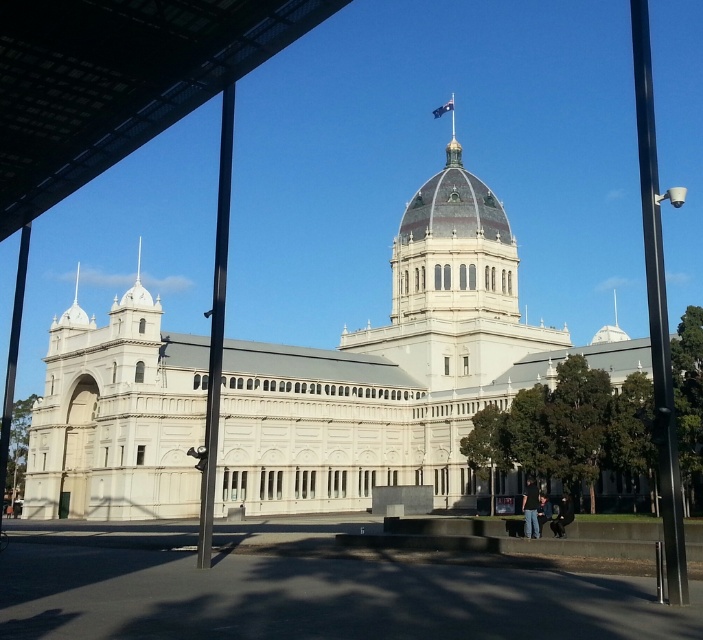
Is dark gray metal canopy at upper center in front of black metal pole at center?

Yes, it is.

Who is lower down, dark gray metal canopy at upper center or black metal pole at center?

black metal pole at center is lower down.

Who is more forward, (15,156) or (224,141)?

Point (15,156) is more forward.

Locate an element on the screen. The width and height of the screenshot is (703, 640). dark gray metal canopy at upper center is located at coordinates (117, 80).

Who is positioned more to the left, black metal pole at center or black metal pole at left?

Positioned to the left is black metal pole at left.

Is black metal pole at center bigger than black metal pole at left?

Actually, black metal pole at center might be smaller than black metal pole at left.

Does point (225, 145) come in front of point (0, 468)?

No, (225, 145) is behind (0, 468).

The height and width of the screenshot is (640, 703). Find the location of `black metal pole at center`. black metal pole at center is located at coordinates (214, 332).

From the picture: Between white stone building at center and black metal pole at center, which one appears on the right side from the viewer's perspective?

white stone building at center is more to the right.

From the picture: Measure the distance between point (619,364) and camera.

They are 74.48 meters apart.

Identify the location of white stone building at center. The image size is (703, 640). (399, 369).